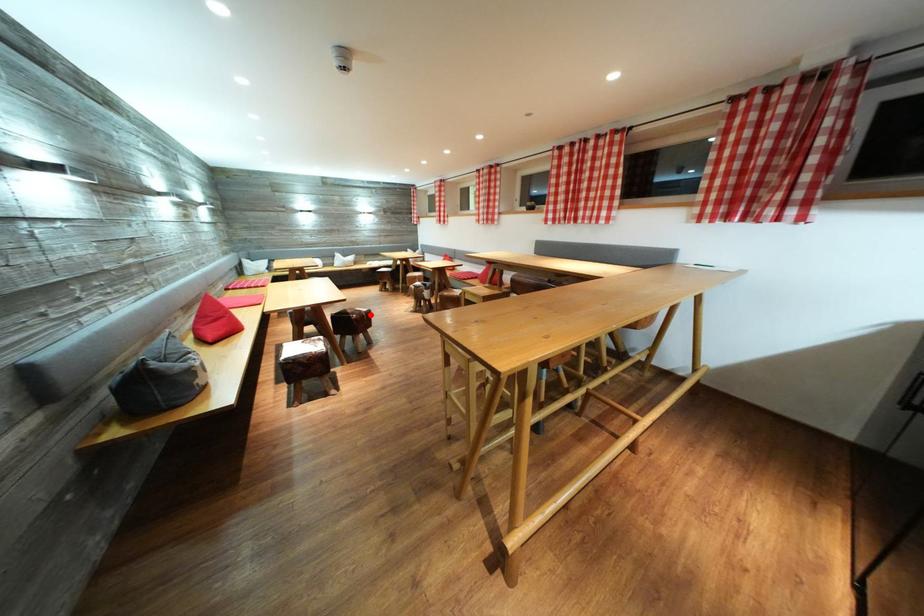
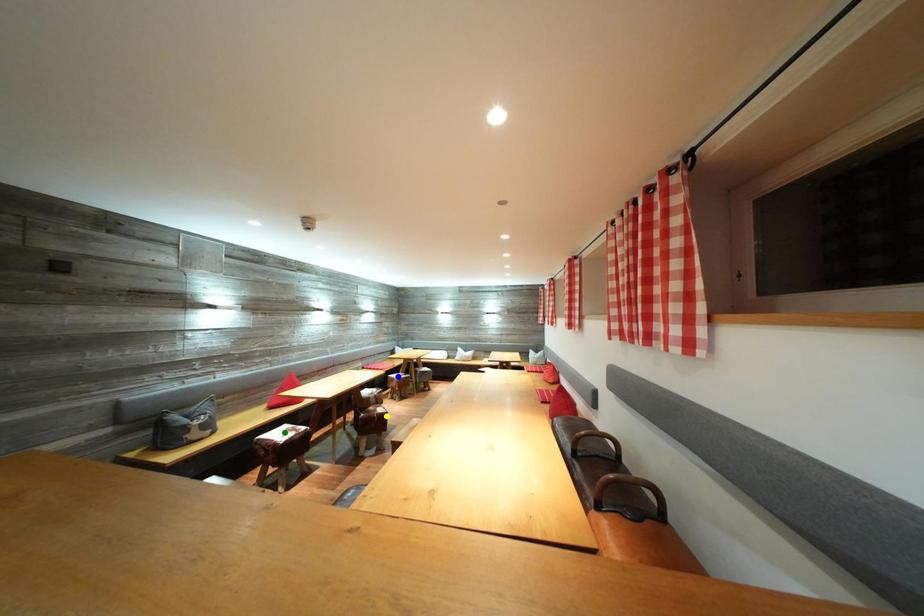
Question: I am providing you with two images of the same scene from different viewpoints. A red point is marked on the first image. You are given multiple points on the second image. In image 2, which mark is for the same physical point as the one in image 1?

Choices:
 (A) green point
 (B) blue point
 (C) yellow point

Answer: (C)